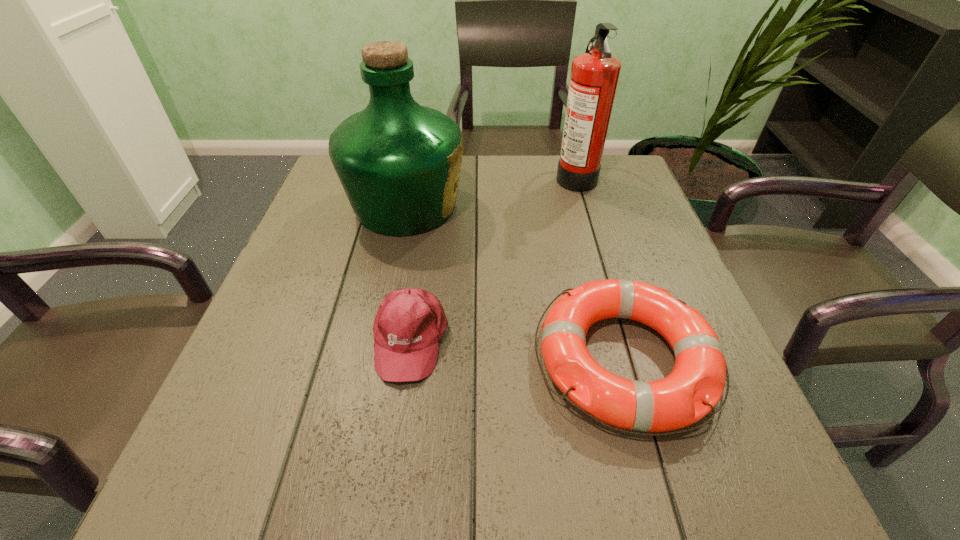
In order to click on fire extinguisher in this screenshot , I will do `click(594, 76)`.

Find the location of a particular element. liquor is located at coordinates (399, 163).

The width and height of the screenshot is (960, 540). I want to click on baseball cap, so click(x=409, y=323).

At what (x,y) coordinates should I click in order to perform the action: click on life buoy. Please return your answer as a coordinate pair (x, y). This screenshot has height=540, width=960. Looking at the image, I should click on (695, 385).

The height and width of the screenshot is (540, 960). Identify the location of vacant space located on the front-facing side of the fire extinguisher. (492, 176).

I want to click on vacant space situated on the front-facing side of the fire extinguisher, so click(504, 176).

Find the location of a particular element. free space located on the front-facing side of the fire extinguisher is located at coordinates (474, 176).

Locate an element on the screen. The height and width of the screenshot is (540, 960). free point located 0.250m on the label side of the liquor is located at coordinates (567, 206).

Where is `vacant area situated at the front of the baseball cap with the brim`? The height and width of the screenshot is (540, 960). vacant area situated at the front of the baseball cap with the brim is located at coordinates (388, 495).

At what (x,y) coordinates should I click in order to perform the action: click on free space located 0.130m on the left of the life buoy. Please return your answer as a coordinate pair (x, y). Looking at the image, I should click on (459, 360).